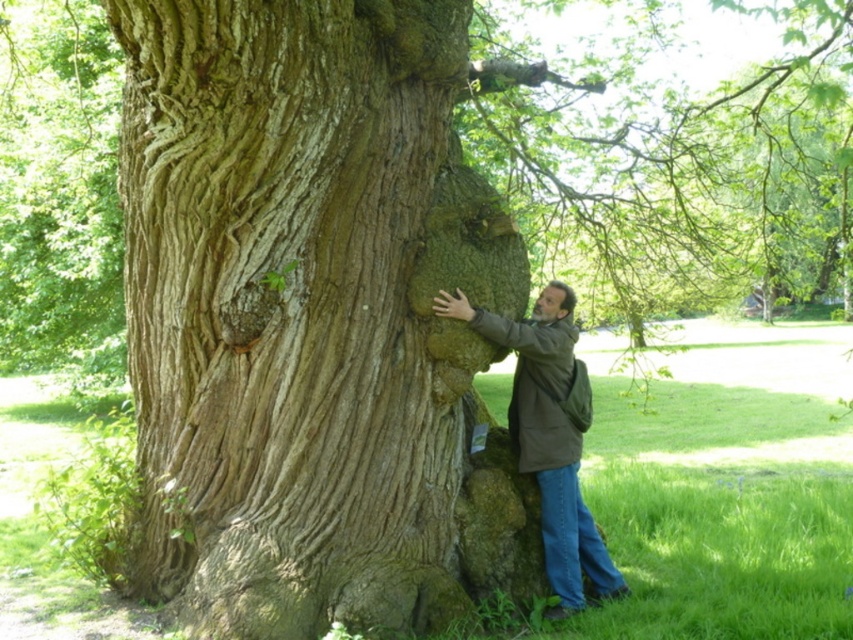
Question: Is rough bark tree trunk at center to the right of brown leather jacket at center from the viewer's perspective?

Choices:
 (A) no
 (B) yes

Answer: (A)

Question: Among these objects, which one is nearest to the camera?

Choices:
 (A) rough bark tree trunk at center
 (B) brown leather jacket at center

Answer: (A)

Question: Can you confirm if rough bark tree trunk at center is wider than brown leather jacket at center?

Choices:
 (A) no
 (B) yes

Answer: (B)

Question: Can you confirm if rough bark tree trunk at center is positioned below brown leather jacket at center?

Choices:
 (A) no
 (B) yes

Answer: (A)

Question: Which point appears closest to the camera in this image?

Choices:
 (A) (236, 573)
 (B) (508, 417)

Answer: (A)

Question: Which point appears closest to the camera in this image?

Choices:
 (A) (300, 106)
 (B) (595, 579)

Answer: (A)